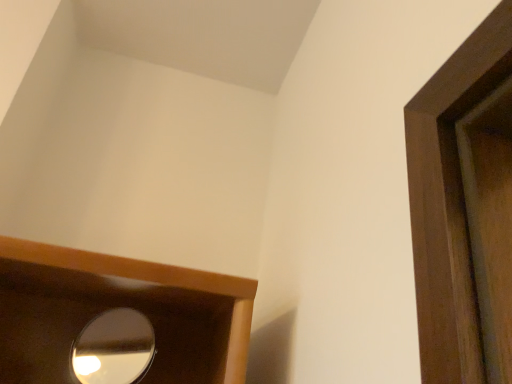
Image resolution: width=512 pixels, height=384 pixels. Find the location of `shiny silver mirror at lower left`. shiny silver mirror at lower left is located at coordinates (114, 348).

The height and width of the screenshot is (384, 512). Describe the element at coordinates (114, 348) in the screenshot. I see `shiny silver mirror at lower left` at that location.

Looking at this image, measure the distance between point (76, 354) and camera.

Point (76, 354) and camera are 34.17 inches apart from each other.

The width and height of the screenshot is (512, 384). In order to click on shiny silver mirror at lower left in this screenshot , I will do `click(114, 348)`.